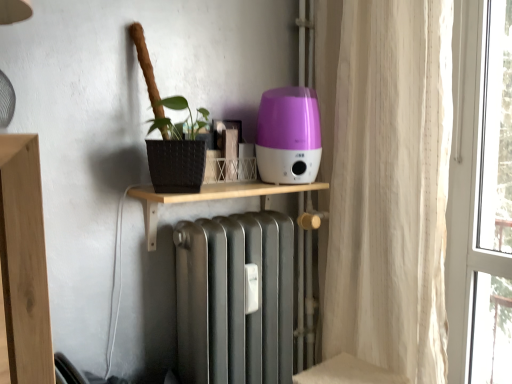
Question: Does purple glossy humidifier at center have a larger size compared to wooden shelf at center?

Choices:
 (A) yes
 (B) no

Answer: (B)

Question: From the image's perspective, is purple glossy humidifier at center located above wooden shelf at center?

Choices:
 (A) no
 (B) yes

Answer: (B)

Question: Is purple glossy humidifier at center to the right of wooden shelf at center from the viewer's perspective?

Choices:
 (A) no
 (B) yes

Answer: (B)

Question: Is purple glossy humidifier at center smaller than wooden shelf at center?

Choices:
 (A) yes
 (B) no

Answer: (A)

Question: Is purple glossy humidifier at center shorter than wooden shelf at center?

Choices:
 (A) no
 (B) yes

Answer: (A)

Question: Would you say purple glossy humidifier at center contains wooden shelf at center?

Choices:
 (A) yes
 (B) no

Answer: (B)

Question: Are white sheer curtain at right and purple glossy humidifier at center beside each other?

Choices:
 (A) no
 (B) yes

Answer: (A)

Question: Is white sheer curtain at right far away from purple glossy humidifier at center?

Choices:
 (A) yes
 (B) no

Answer: (B)

Question: Considering the relative sizes of white sheer curtain at right and purple glossy humidifier at center in the image provided, is white sheer curtain at right taller than purple glossy humidifier at center?

Choices:
 (A) yes
 (B) no

Answer: (A)

Question: Does white sheer curtain at right appear on the left side of purple glossy humidifier at center?

Choices:
 (A) no
 (B) yes

Answer: (A)

Question: Is white sheer curtain at right positioned before purple glossy humidifier at center?

Choices:
 (A) yes
 (B) no

Answer: (A)

Question: From a real-world perspective, does white sheer curtain at right stand above purple glossy humidifier at center?

Choices:
 (A) yes
 (B) no

Answer: (B)

Question: Is wooden shelf at center aimed at purple glossy humidifier at center?

Choices:
 (A) yes
 (B) no

Answer: (B)